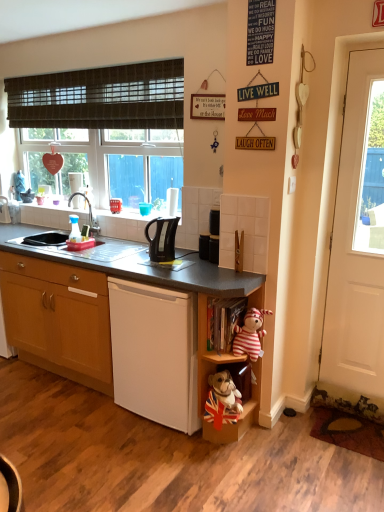
Where is `free space in front of wooden bookshelf at lower center, acting as the 1th shelf starting from the bottom`? free space in front of wooden bookshelf at lower center, acting as the 1th shelf starting from the bottom is located at coordinates (235, 467).